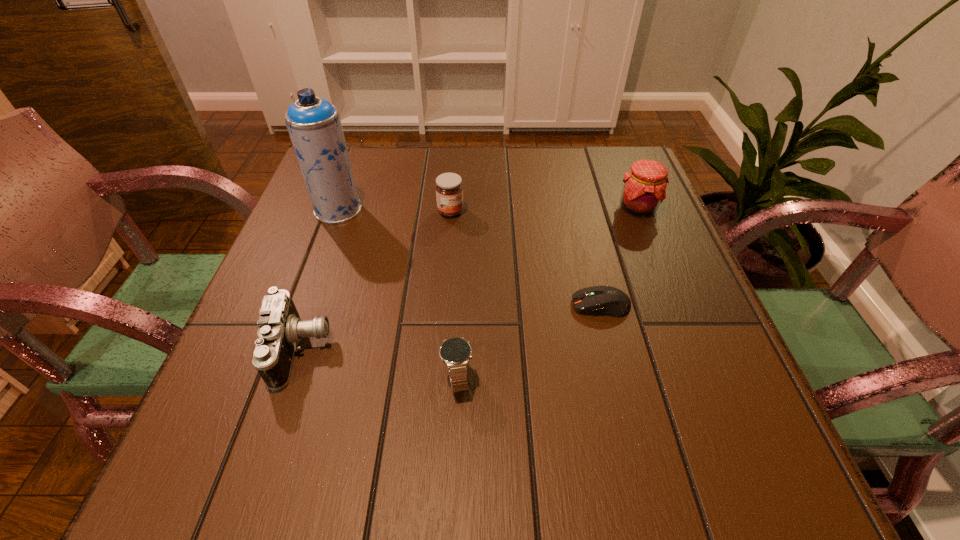
Identify the location of aerosol can. The image size is (960, 540). (x=314, y=126).

Where is `the taller jam`? the taller jam is located at coordinates (644, 188).

Image resolution: width=960 pixels, height=540 pixels. I want to click on the right jam, so click(x=644, y=188).

The width and height of the screenshot is (960, 540). Find the location of `the shorter jam`. the shorter jam is located at coordinates (449, 189).

Identify the location of camera. (280, 329).

Locate an element on the screen. The width and height of the screenshot is (960, 540). watch is located at coordinates (455, 352).

Where is `the second object from right to left`? The height and width of the screenshot is (540, 960). the second object from right to left is located at coordinates (607, 300).

In order to click on computer equipment in this screenshot , I will do `click(607, 300)`.

Where is `vacant space situated 0.160m on the back of the tallest object`? This screenshot has width=960, height=540. vacant space situated 0.160m on the back of the tallest object is located at coordinates (356, 161).

The image size is (960, 540). Identify the location of vacant point located 0.230m on the back of the fifth shortest object. (613, 147).